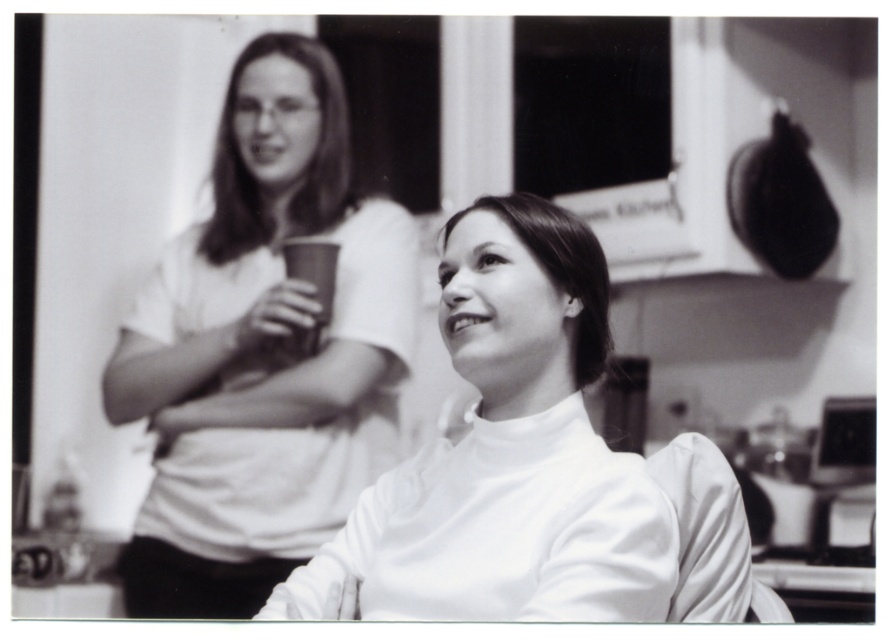
From the picture: Does matte white shirt at upper left appear on the right side of white matte turtleneck at center?

Incorrect, matte white shirt at upper left is not on the right side of white matte turtleneck at center.

Who is shorter, matte white shirt at upper left or white matte turtleneck at center?

With less height is white matte turtleneck at center.

This screenshot has width=891, height=640. In order to click on matte white shirt at upper left in this screenshot , I will do `click(262, 352)`.